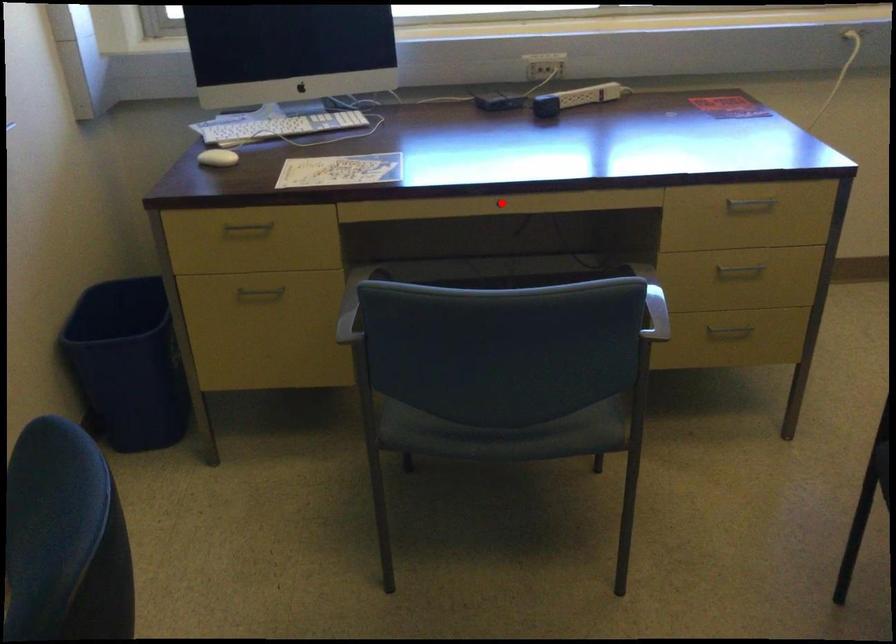
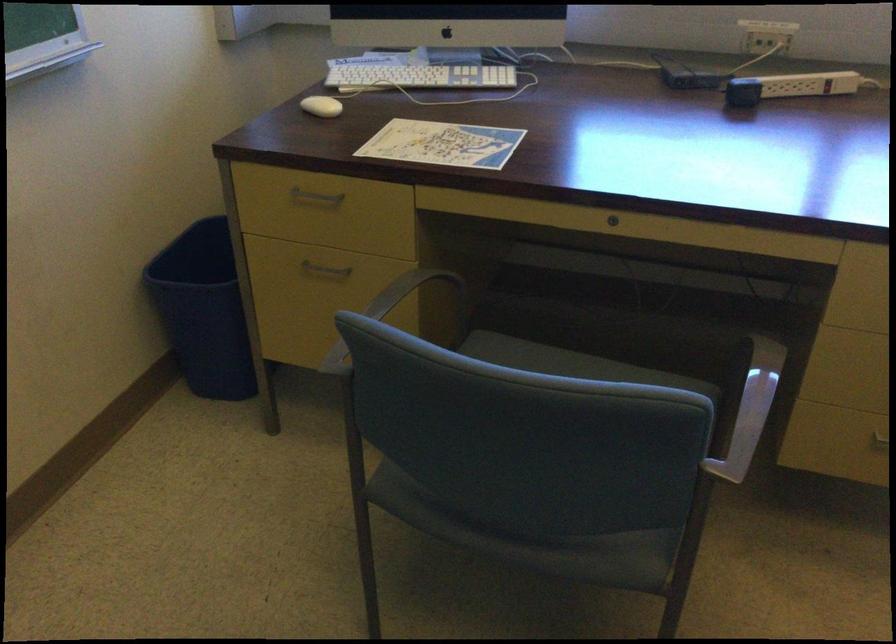
Question: I am providing you with two images of the same scene from different viewpoints. Given a red point in image1, look at the same physical point in image2. Is it:

Choices:
 (A) Closer to the viewpoint
 (B) Farther from the viewpoint

Answer: (A)